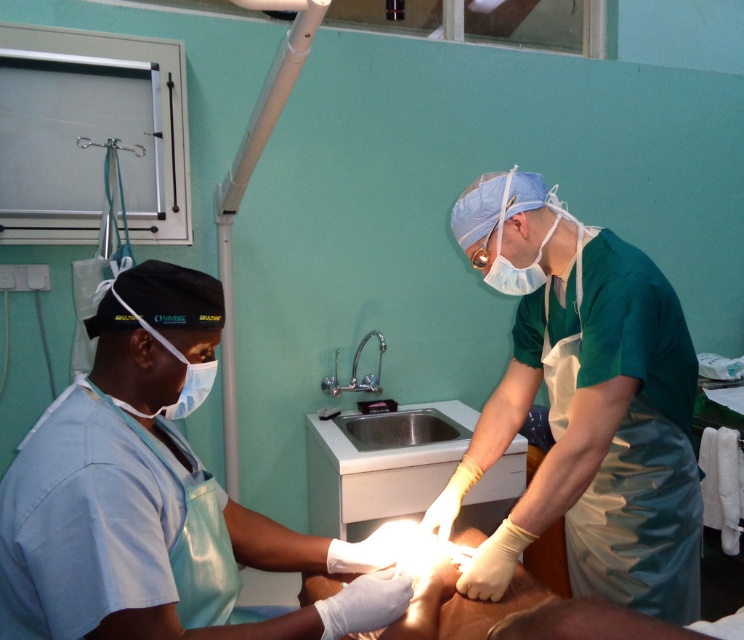
Question: Considering the relative positions of blue surgical gown at center and green matte surgical gown at center in the image provided, where is blue surgical gown at center located with respect to green matte surgical gown at center?

Choices:
 (A) below
 (B) above

Answer: (A)

Question: Which object is closer to the camera taking this photo?

Choices:
 (A) green matte surgical gown at center
 (B) blue surgical gown at center

Answer: (B)

Question: Which of the following is the closest to the observer?

Choices:
 (A) blue surgical gown at center
 (B) green matte surgical gown at center

Answer: (A)

Question: Is blue surgical gown at center behind green matte surgical gown at center?

Choices:
 (A) yes
 (B) no

Answer: (B)

Question: Is blue surgical gown at center thinner than green matte surgical gown at center?

Choices:
 (A) no
 (B) yes

Answer: (A)